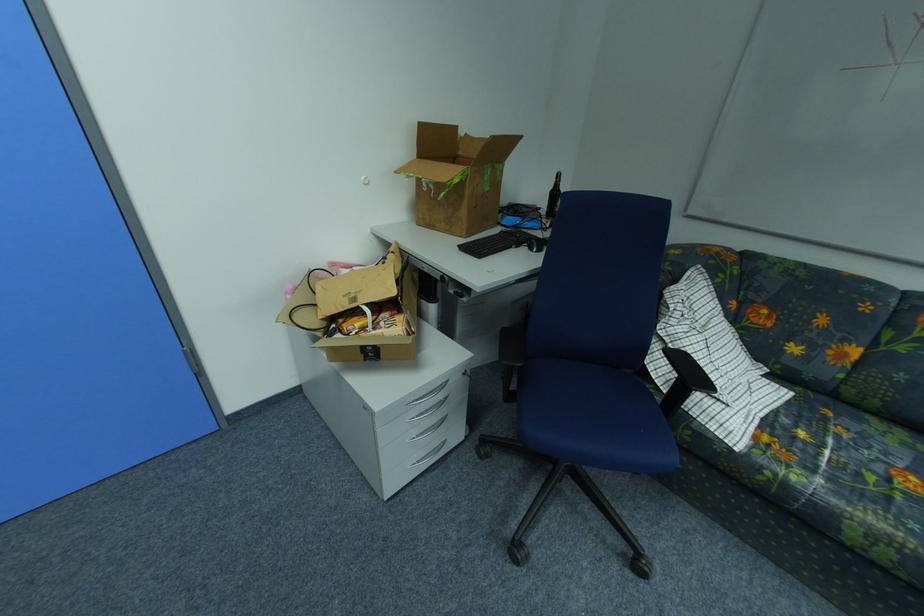
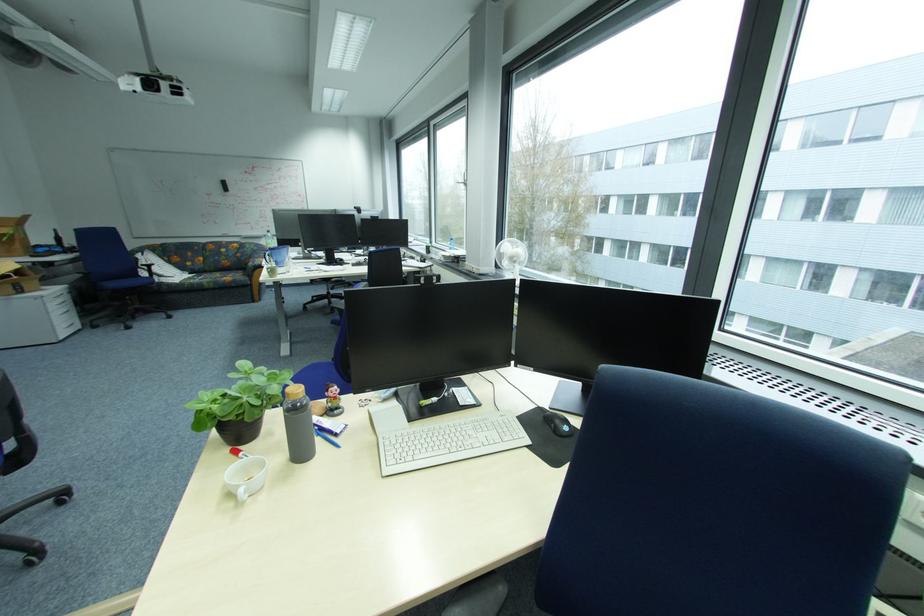
Find the pixel in the second image that matches the point at 861,535 in the first image.

(214, 286)